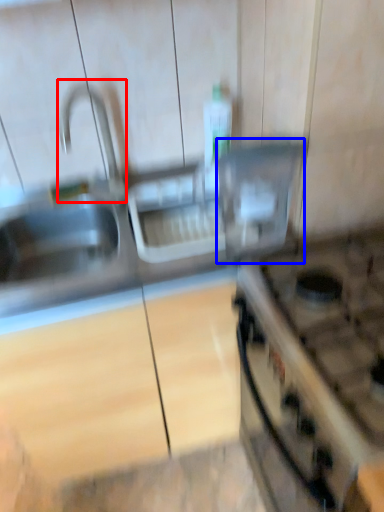
Question: Which object appears farthest to the camera in this image, faucet (highlighted by a red box) or appliance (highlighted by a blue box)?

Choices:
 (A) faucet
 (B) appliance

Answer: (A)